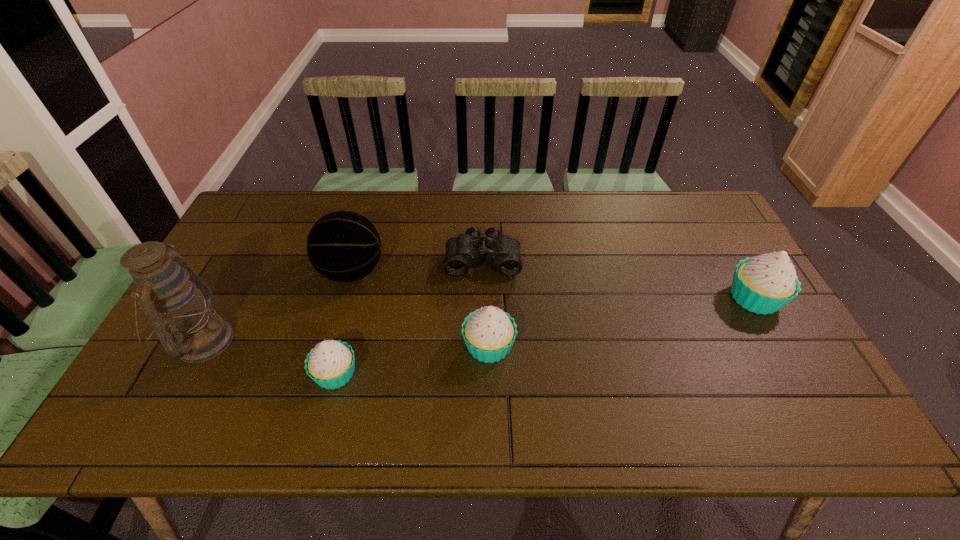
The image size is (960, 540). I want to click on spot to insert another cupcake for uniform distribution, so click(628, 321).